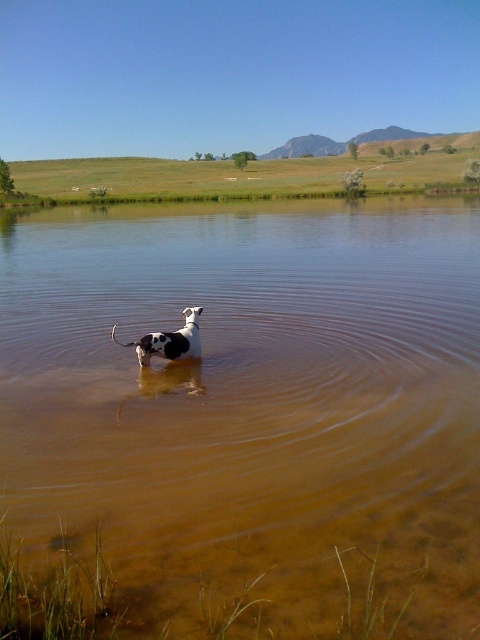
Which is above, brown translucent water at center or black and white spotted dog at center?

brown translucent water at center

Is brown translucent water at center taller than black and white spotted dog at center?

Correct, brown translucent water at center is much taller as black and white spotted dog at center.

Between point (275, 387) and point (189, 340), which one is positioned behind?

Positioned behind is point (189, 340).

You are a GUI agent. You are given a task and a screenshot of the screen. Output one action in this format:
    pyautogui.click(x=<x>, y=<y>)
    Task: Click on the brown translucent water at center
    This screenshot has width=480, height=640.
    Given the screenshot: What is the action you would take?
    pyautogui.click(x=245, y=419)